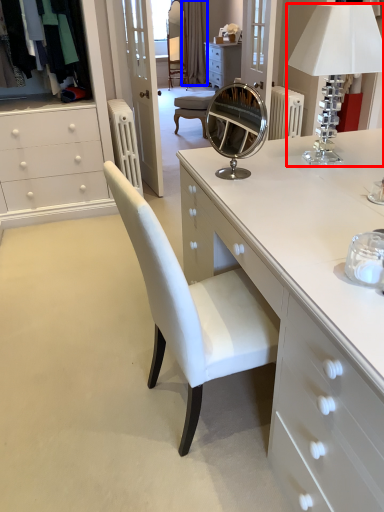
Question: Which of the following is the closest to the observer, table lamp (highlighted by a red box) or curtain (highlighted by a blue box)?

Choices:
 (A) table lamp
 (B) curtain

Answer: (A)